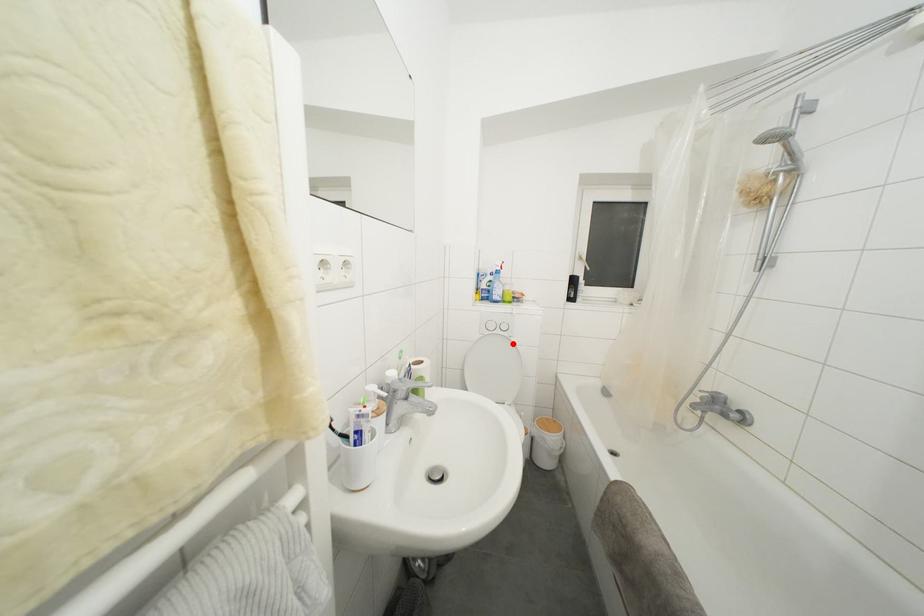
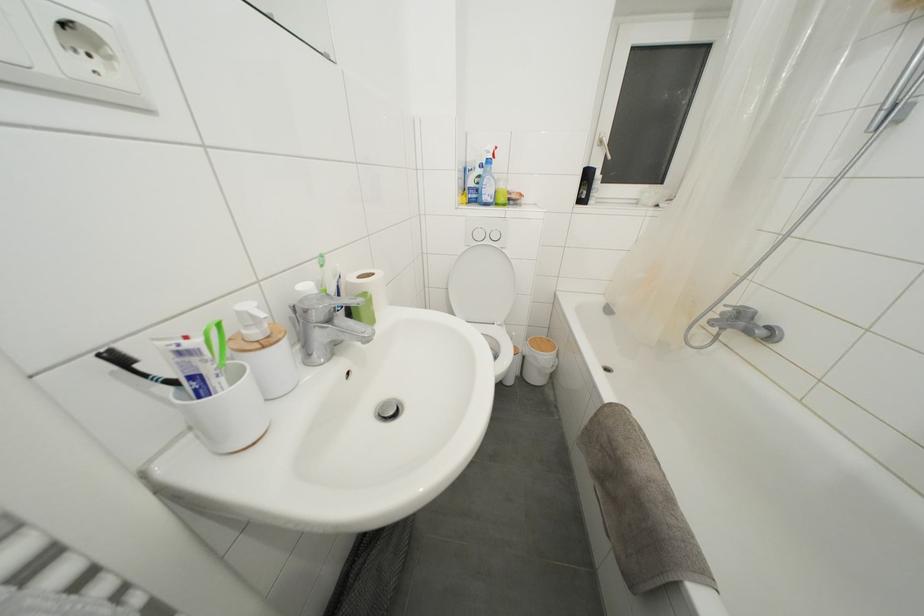
Find the pixel in the second image that matches the highlighted location in the first image.

(505, 256)